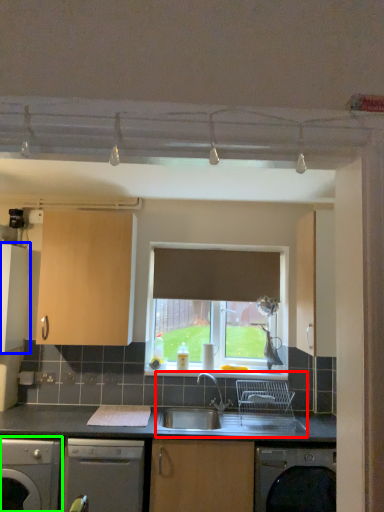
Question: Estimate the real-world distances between objects in this image. Which object is farther from sink (highlighted by a red box), cabinetry (highlighted by a blue box) or dishwasher (highlighted by a green box)?

Choices:
 (A) cabinetry
 (B) dishwasher

Answer: (A)